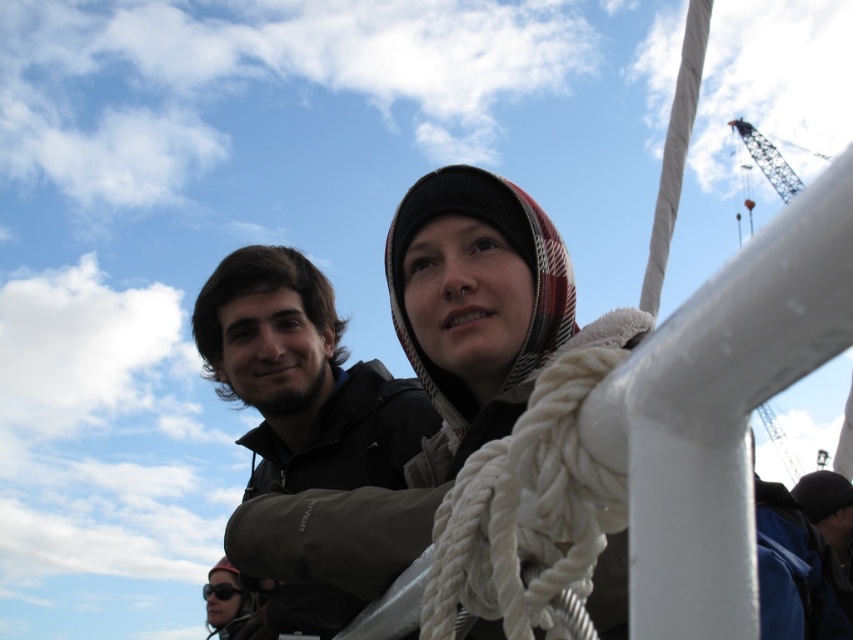
Where is `plaid woolen hat at upper center`? The image size is (853, 640). plaid woolen hat at upper center is located at coordinates (718, 410).

Between point (759, 273) and point (334, 445), which one is positioned behind?

The point (334, 445) is behind.

Is point (498, 422) farther from camera compared to point (242, 284)?

No, it is not.

Where is `plaid woolen hat at upper center`? The image size is (853, 640). plaid woolen hat at upper center is located at coordinates (718, 410).